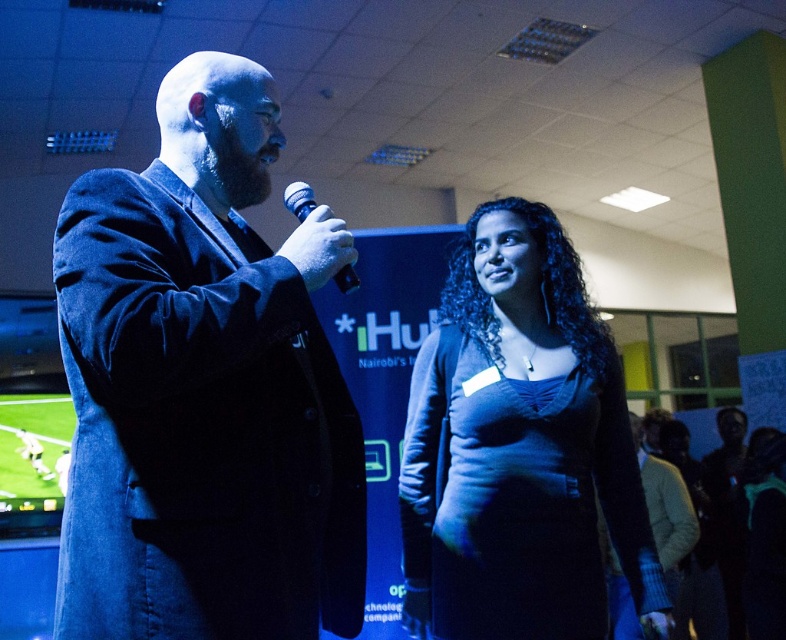
Question: Which object is the farthest from the blue matte dress at center?

Choices:
 (A) white matte microphone at center
 (B) dark blue suit at left

Answer: (B)

Question: Which point appears closest to the camera in this image?

Choices:
 (A) (630, 541)
 (B) (226, 637)

Answer: (B)

Question: Can you confirm if dark blue suit at left is positioned to the right of white matte microphone at center?

Choices:
 (A) no
 (B) yes

Answer: (A)

Question: Which object is farther from the camera taking this photo?

Choices:
 (A) blue matte dress at center
 (B) dark blue suit at left

Answer: (A)

Question: Considering the relative positions of dark blue suit at left and white matte microphone at center in the image provided, where is dark blue suit at left located with respect to white matte microphone at center?

Choices:
 (A) above
 (B) below

Answer: (B)

Question: Is dark blue suit at left positioned before blue matte dress at center?

Choices:
 (A) yes
 (B) no

Answer: (A)